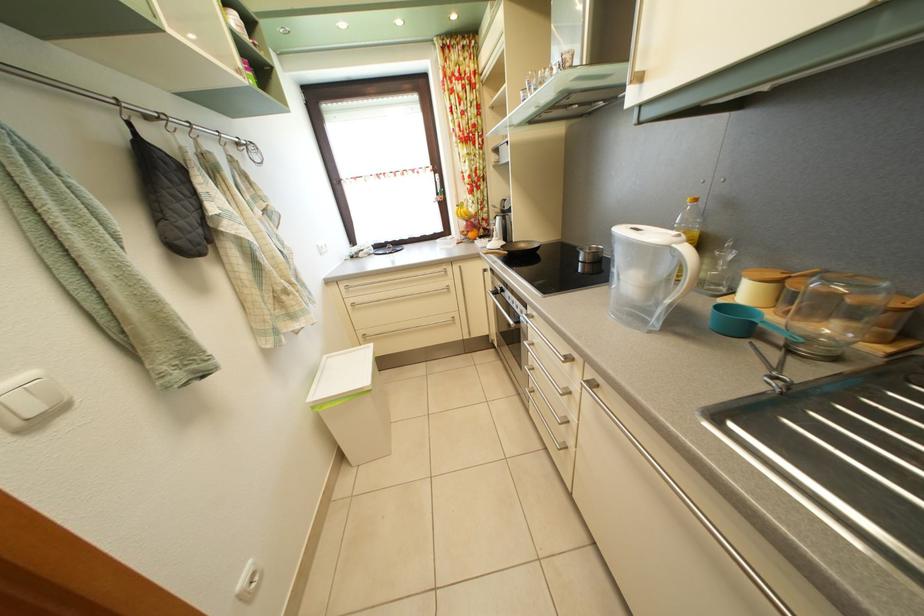
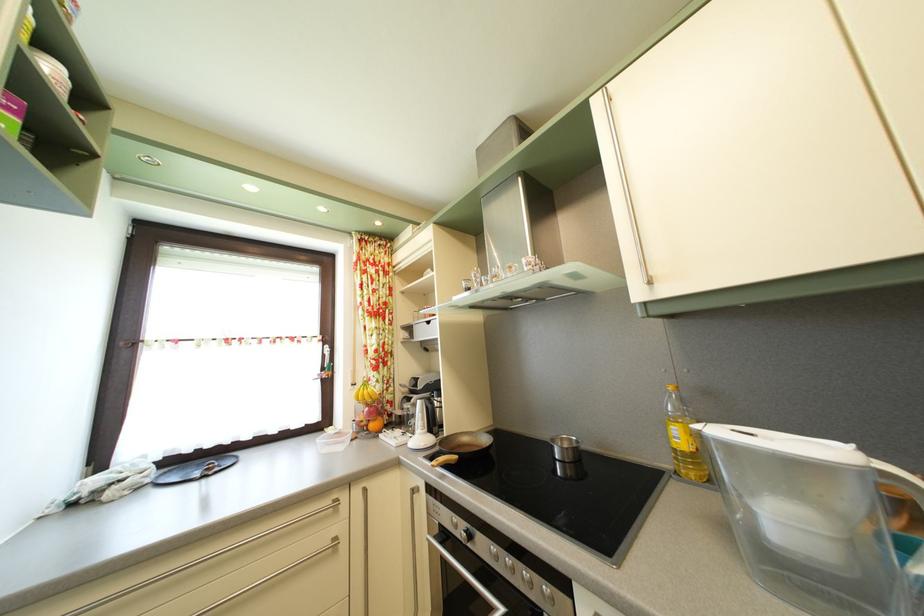
The point at (x=599, y=256) is marked in the first image. Where is the corresponding point in the second image?

(569, 448)